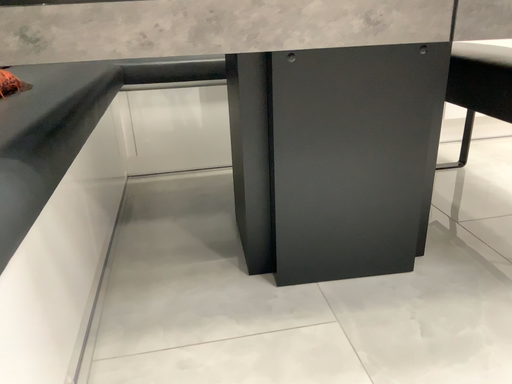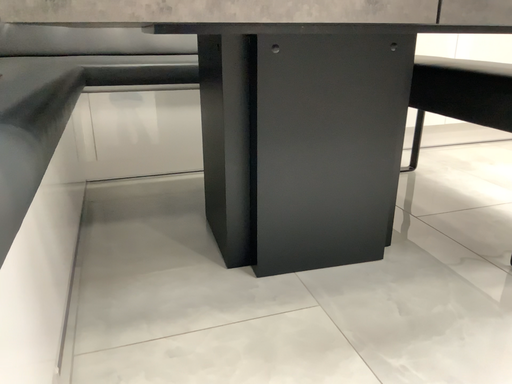
Question: How did the camera likely rotate when shooting the video?

Choices:
 (A) rotated right
 (B) rotated left

Answer: (A)